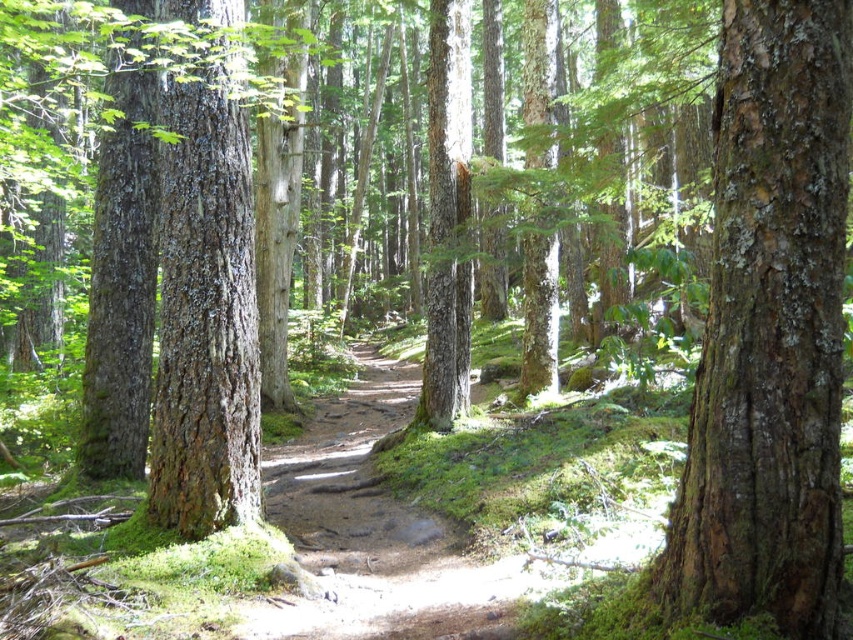
Does smooth brown bark at center have a lesser width compared to smooth brown bark tree at center?

Yes, smooth brown bark at center is thinner than smooth brown bark tree at center.

Is point (757, 60) farther from viewer compared to point (184, 392)?

No, it is in front of (184, 392).

Is point (781, 230) farther from camera compared to point (177, 300)?

No, it is not.

Identify the location of smooth brown bark at center. (769, 332).